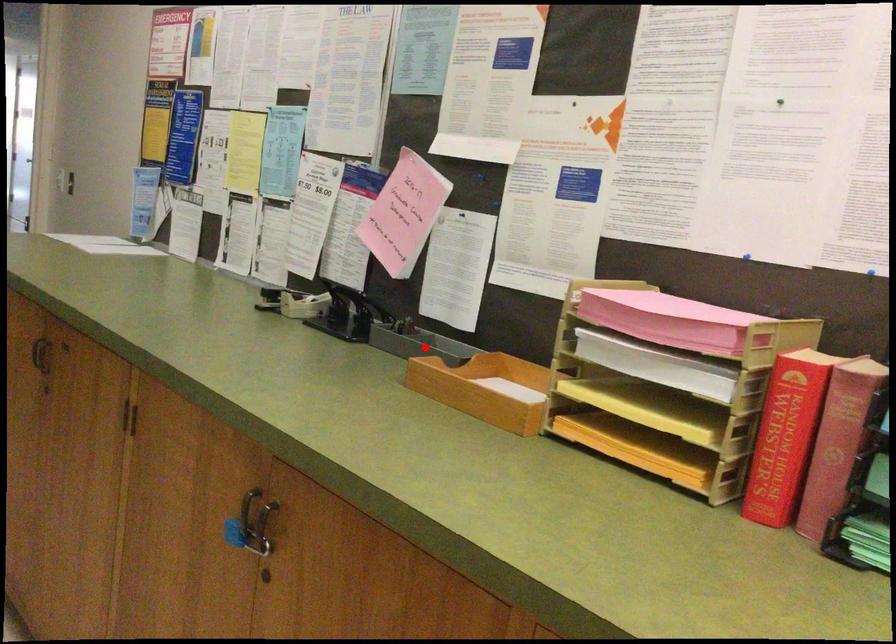
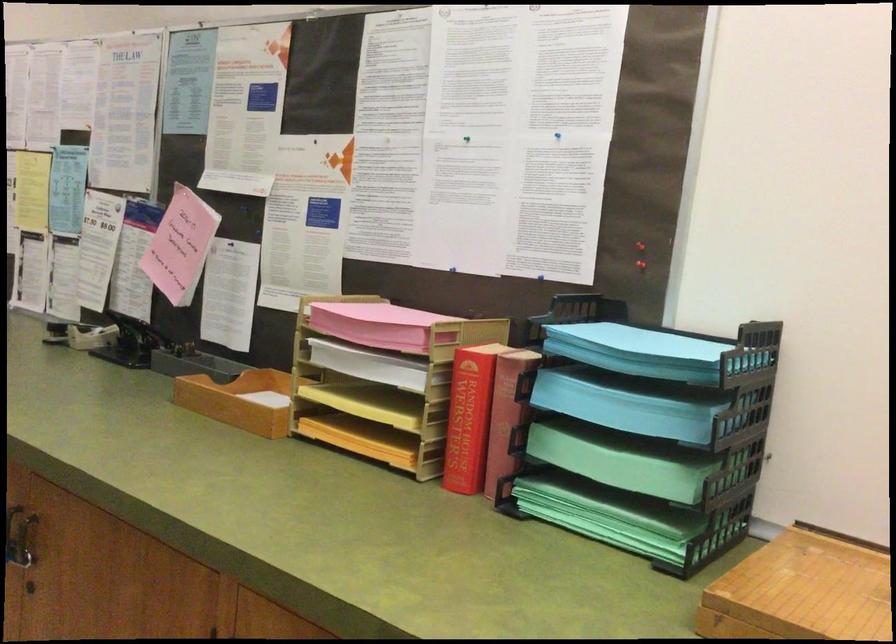
Locate, in the second image, the point that corresponds to the highlighted location in the first image.

(202, 368)